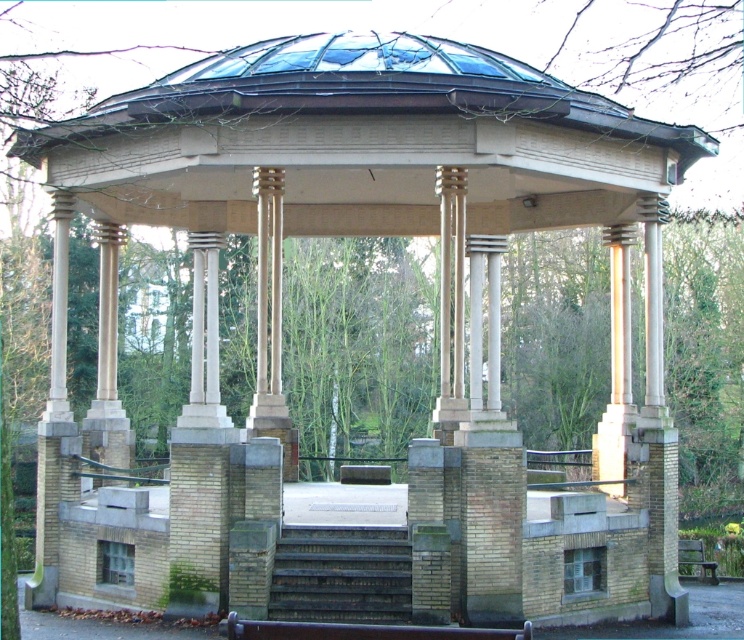
You are planning to seat a group of people in the classical pavilion. The wooden bench at center and the green wooden bench at lower right are available. Which bench can accommodate more people if they need to sit side by side?

The green wooden bench at lower right can accommodate more people since it has a greater width than the wooden bench at center.

You are standing in front of the classical pavilion and want to sit on one of the benches. Which bench, the wooden bench at center or the green wooden bench at lower right, is closer to you?

The wooden bench at center is closer to you than the green wooden bench at lower right.

You are standing at point (362,630) in the classical pavilion. What object is located at your current position?

The wooden bench at center is located at point (362,630).